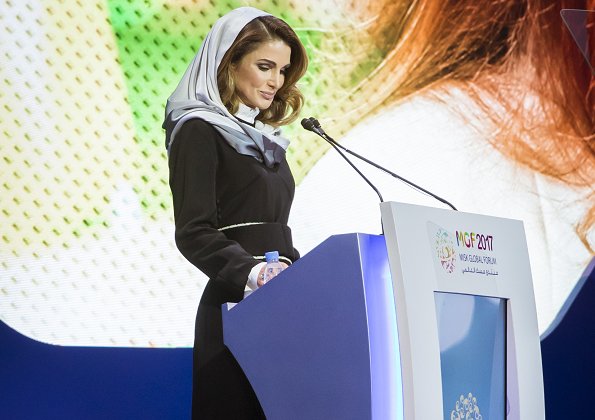
Identify the location of lectern. Image resolution: width=595 pixels, height=420 pixels. (333, 286).